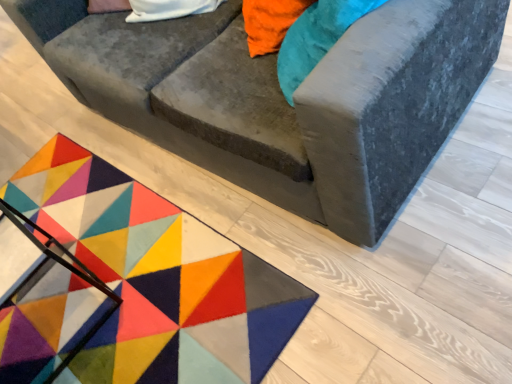
Image resolution: width=512 pixels, height=384 pixels. I want to click on multicolored felt mat at lower left, so click(x=158, y=277).

Describe the element at coordinates (158, 277) in the screenshot. I see `multicolored felt mat at lower left` at that location.

The image size is (512, 384). What do you see at coordinates (297, 95) in the screenshot? I see `velvet gray couch at center` at bounding box center [297, 95].

Measure the distance between point (57, 3) and camera.

5.96 feet.

At what (x,y) coordinates should I click in order to perform the action: click on velvet gray couch at center. Please return your answer as a coordinate pair (x, y). This screenshot has width=512, height=384. Looking at the image, I should click on (297, 95).

What is the approximate width of velvet gray couch at center?

velvet gray couch at center is 1.02 meters wide.

Measure the distance between velvet gray couch at center and camera.

The distance of velvet gray couch at center from camera is 34.98 inches.

Where is `multicolored felt mat at lower left`? multicolored felt mat at lower left is located at coordinates (158, 277).

In the scene shown: Is velvet gray couch at center to the left or to the right of multicolored felt mat at lower left in the image?

Based on their positions, velvet gray couch at center is located to the right of multicolored felt mat at lower left.

Considering the positions of objects velvet gray couch at center and multicolored felt mat at lower left in the image provided, who is behind, velvet gray couch at center or multicolored felt mat at lower left?

multicolored felt mat at lower left is further from the camera.

Between point (298, 109) and point (68, 300), which one is positioned in front?

The point (298, 109) is more forward.

From the image's perspective, which one is positioned lower, velvet gray couch at center or multicolored felt mat at lower left?

multicolored felt mat at lower left appears lower in the image.

From a real-world perspective, is velvet gray couch at center physically below multicolored felt mat at lower left?

No, from a real-world perspective, velvet gray couch at center is not beneath multicolored felt mat at lower left.

Considering the sizes of velvet gray couch at center and multicolored felt mat at lower left in the image, is velvet gray couch at center wider or thinner than multicolored felt mat at lower left?

Clearly, velvet gray couch at center has more width compared to multicolored felt mat at lower left.

Considering the sizes of objects velvet gray couch at center and multicolored felt mat at lower left in the image provided, who is taller, velvet gray couch at center or multicolored felt mat at lower left?

velvet gray couch at center is taller.

Considering the relative sizes of velvet gray couch at center and multicolored felt mat at lower left in the image provided, is velvet gray couch at center bigger than multicolored felt mat at lower left?

Yes.

Is velvet gray couch at center inside the boundaries of multicolored felt mat at lower left, or outside?

velvet gray couch at center is not inside multicolored felt mat at lower left, it's outside.

Are velvet gray couch at center and multicolored felt mat at lower left beside each other?

They are not placed beside each other.

Could you tell me if velvet gray couch at center is turned towards multicolored felt mat at lower left?

Yes, velvet gray couch at center is turned towards multicolored felt mat at lower left.

The height and width of the screenshot is (384, 512). Find the location of `studio couch above the multicolored felt mat at lower left (from a real-world perspective)`. studio couch above the multicolored felt mat at lower left (from a real-world perspective) is located at coordinates (297, 95).

Which is more to the right, multicolored felt mat at lower left or velvet gray couch at center?

velvet gray couch at center.

Considering their positions, is multicolored felt mat at lower left located in front of or behind velvet gray couch at center?

multicolored felt mat at lower left is positioned farther from the viewer than velvet gray couch at center.

Which is nearer, (106, 379) or (476, 35)?

Clearly, point (106, 379) is more distant from the camera than point (476, 35).

From the image's perspective, between multicolored felt mat at lower left and velvet gray couch at center, which one is located above?

velvet gray couch at center is shown above in the image.

From a real-world perspective, relative to velvet gray couch at center, is multicolored felt mat at lower left vertically above or below?

multicolored felt mat at lower left is below velvet gray couch at center.

Does multicolored felt mat at lower left have a greater width compared to velvet gray couch at center?

No, multicolored felt mat at lower left is not wider than velvet gray couch at center.

Can you confirm if multicolored felt mat at lower left is taller than velvet gray couch at center?

No, multicolored felt mat at lower left is not taller than velvet gray couch at center.

Looking at the image, does multicolored felt mat at lower left seem bigger or smaller compared to velvet gray couch at center?

Considering their sizes, multicolored felt mat at lower left takes up less space than velvet gray couch at center.

Can velvet gray couch at center be found inside multicolored felt mat at lower left?

No, velvet gray couch at center is not a part of multicolored felt mat at lower left.

Is multicolored felt mat at lower left in contact with velvet gray couch at center?

No, multicolored felt mat at lower left is not beside velvet gray couch at center.

Is multicolored felt mat at lower left oriented away from velvet gray couch at center?

No, multicolored felt mat at lower left is not facing away from velvet gray couch at center.

Identify the location of mat lying below the velvet gray couch at center (from the image's perspective). (158, 277).

Where is `studio couch above the multicolored felt mat at lower left (from a real-world perspective)`? The width and height of the screenshot is (512, 384). studio couch above the multicolored felt mat at lower left (from a real-world perspective) is located at coordinates (297, 95).

Where is `mat on the left side of velvet gray couch at center`? mat on the left side of velvet gray couch at center is located at coordinates (158, 277).